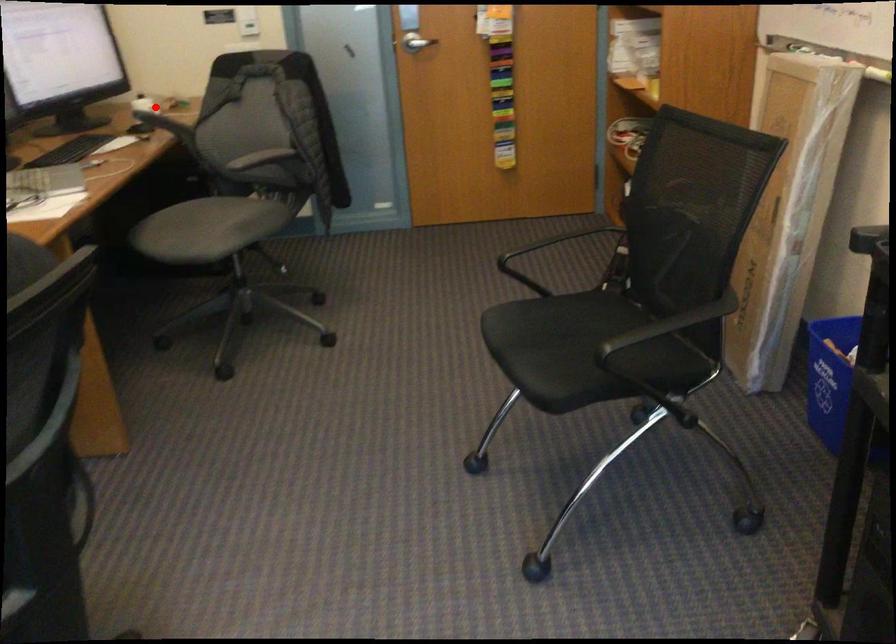
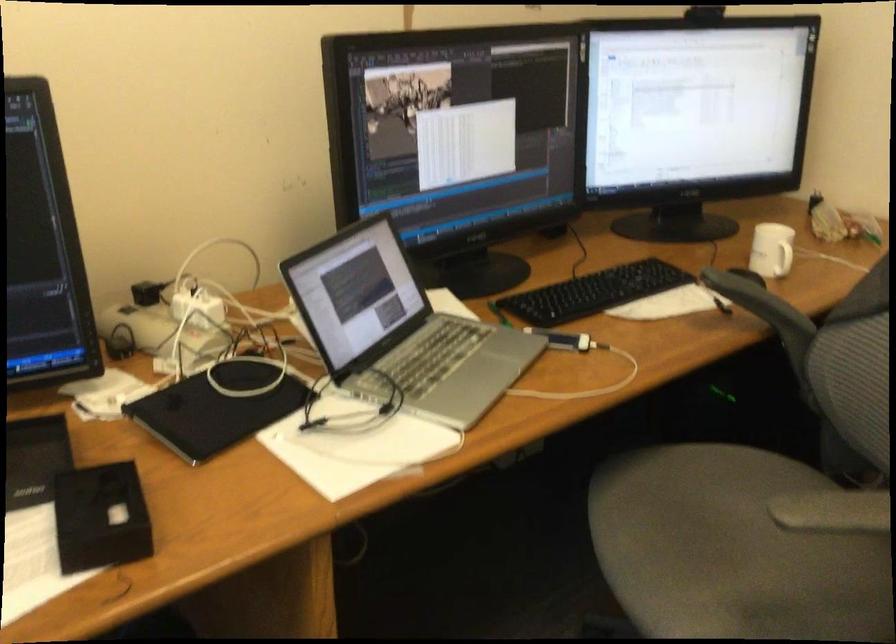
Question: I am providing you with two images of the same scene from different viewpoints. In image1, a red point is highlighted. Considering the same 3D point in image2, which of the following is correct?

Choices:
 (A) It is closer
 (B) It is farther

Answer: (A)